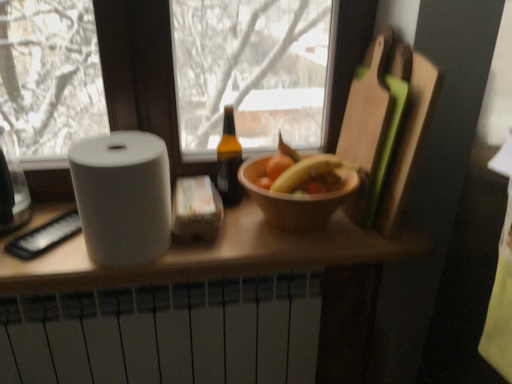
The width and height of the screenshot is (512, 384). What are the coordinates of `free point below wooden bowl at center (from a real-world perspective)` in the screenshot? It's located at (293, 240).